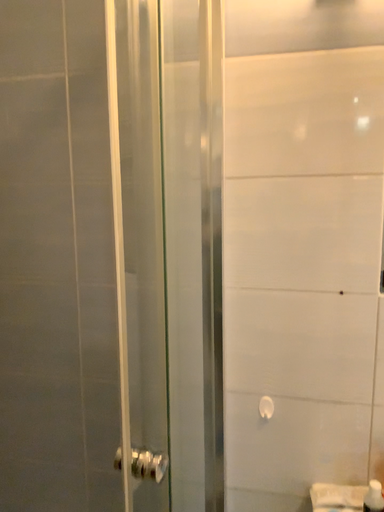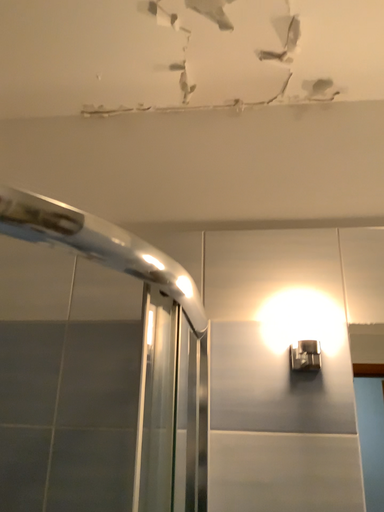
Question: Which way did the camera rotate in the video?

Choices:
 (A) rotated downward
 (B) rotated upward

Answer: (B)